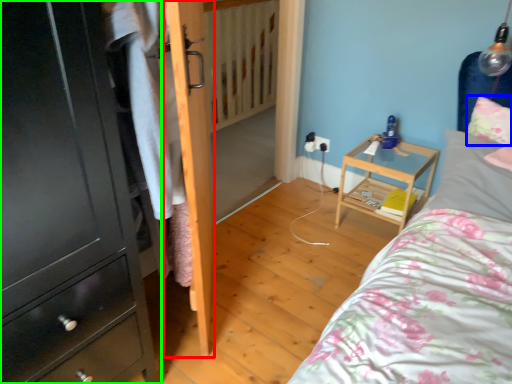
Question: Which is nearer to the door (highlighted by a red box)? pillow (highlighted by a blue box) or chest of drawers (highlighted by a green box).

Choices:
 (A) pillow
 (B) chest of drawers

Answer: (B)